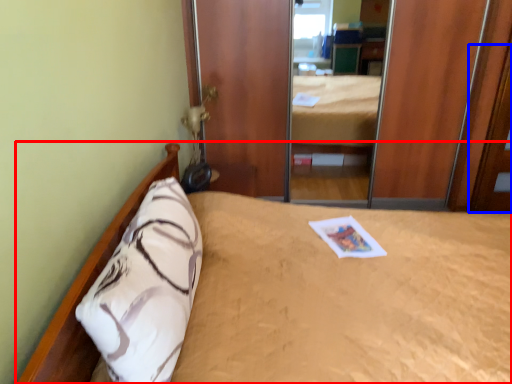
Question: Which point is further to the camera, bed (highlighted by a red box) or door (highlighted by a blue box)?

Choices:
 (A) bed
 (B) door

Answer: (B)